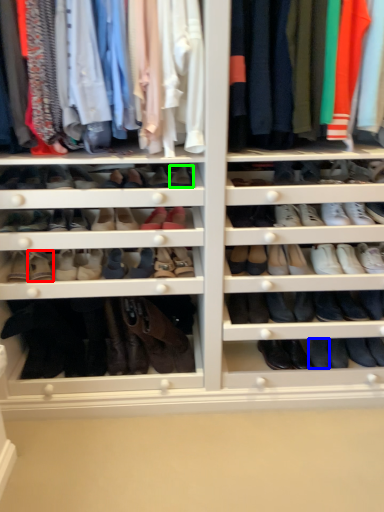
Question: Considering the real-world distances, which object is closest to shoe (highlighted by a red box)? shoe (highlighted by a blue box) or shoe (highlighted by a green box).

Choices:
 (A) shoe
 (B) shoe

Answer: (B)